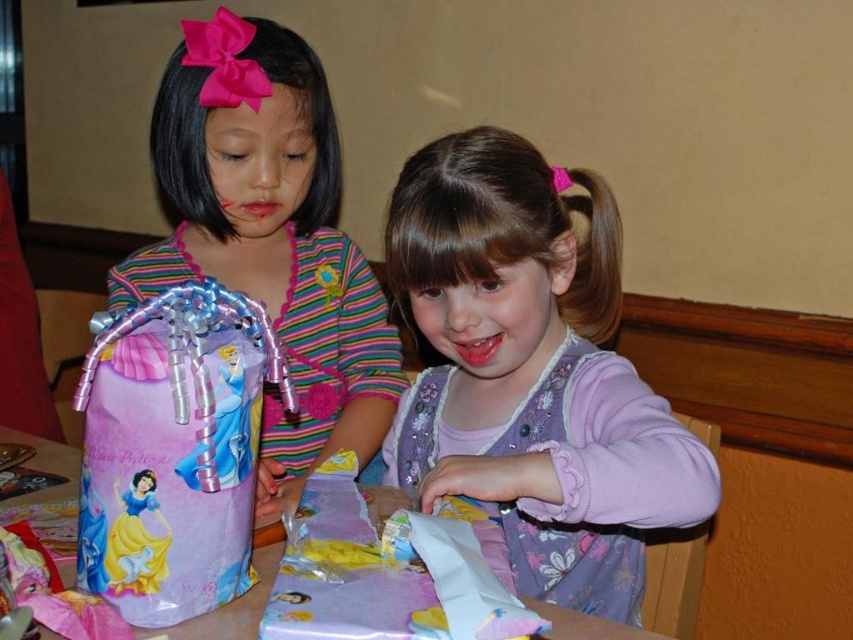
Question: Which object is the closest to the purple floral dress at center?

Choices:
 (A) matte plastic bag at left
 (B) purple paper bag at center
 (C) matte pink gift bag at left

Answer: (B)

Question: Is purple floral dress at center above purple paper bag at center?

Choices:
 (A) yes
 (B) no

Answer: (A)

Question: Which object appears closest to the camera in this image?

Choices:
 (A) matte plastic bag at left
 (B) purple paper bag at center
 (C) matte pink gift bag at left

Answer: (A)

Question: Observing the image, what is the correct spatial positioning of purple floral dress at center in reference to pink glossy paper at lower center?

Choices:
 (A) right
 (B) left

Answer: (A)

Question: Is purple floral dress at center positioned in front of matte plastic bag at left?

Choices:
 (A) yes
 (B) no

Answer: (B)

Question: Which of the following is the closest to the observer?

Choices:
 (A) purple floral dress at center
 (B) matte pink gift bag at left

Answer: (A)